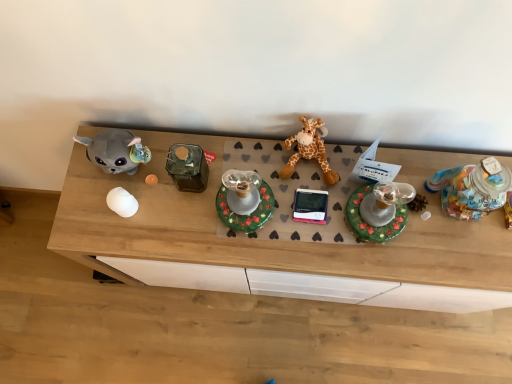
I want to click on vacant space to the left of orange plush giraffe at center, so click(254, 155).